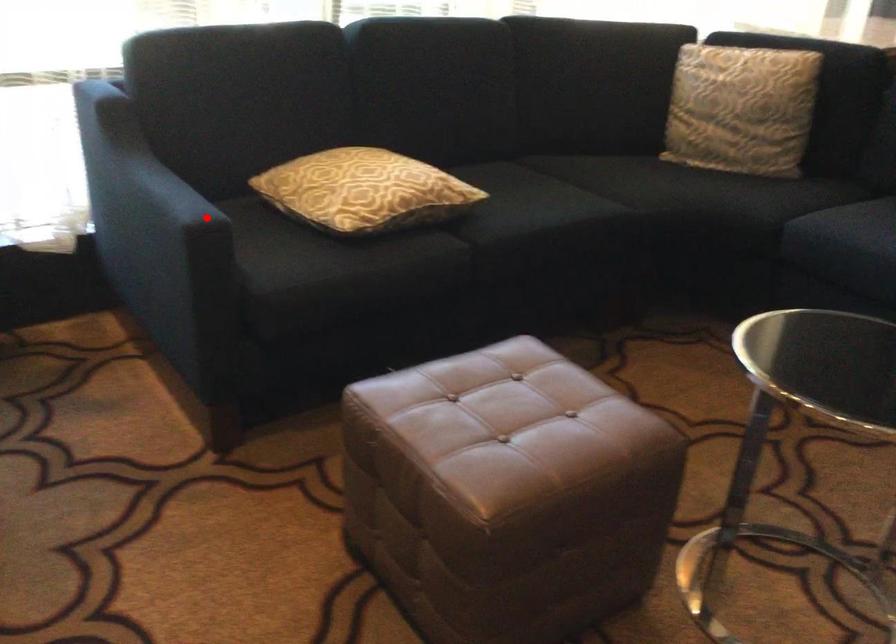
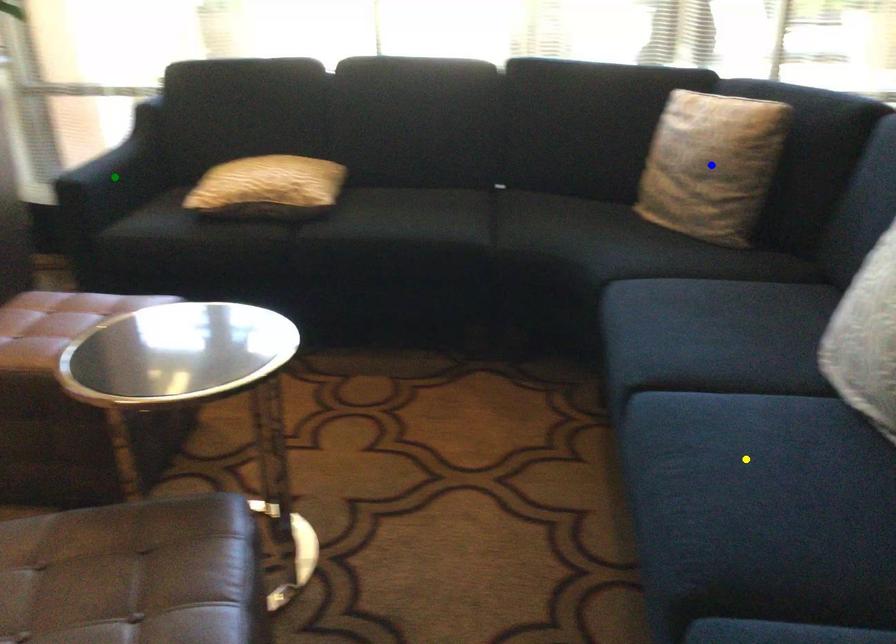
Question: I am providing you with two images of the same scene from different viewpoints. A red point is marked on the first image. You are given multiple points on the second image. Which mark in image 2 goes with the point in image 1?

Choices:
 (A) blue point
 (B) green point
 (C) yellow point

Answer: (B)